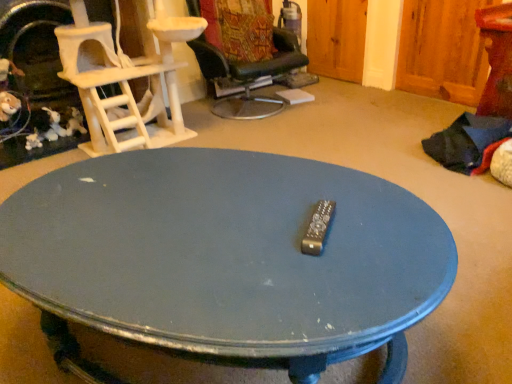
Question: From a real-world perspective, is black leather chair at upper center, acting as the 1th chair starting from the right, located higher than white textured cat tree at left, positioned as the first chair in left-to-right order?

Choices:
 (A) no
 (B) yes

Answer: (A)

Question: Is the surface of black leather chair at upper center, which ranks as the second chair in left-to-right order, in direct contact with white textured cat tree at left, positioned as the first chair in left-to-right order?

Choices:
 (A) no
 (B) yes

Answer: (A)

Question: Is black leather chair at upper center, which ranks as the second chair in left-to-right order, oriented away from white textured cat tree at left, positioned as the first chair in left-to-right order?

Choices:
 (A) yes
 (B) no

Answer: (B)

Question: Would you say black leather chair at upper center, which ranks as the second chair in left-to-right order, is a long distance from white textured cat tree at left, arranged as the second chair when viewed from the right?

Choices:
 (A) yes
 (B) no

Answer: (B)

Question: Is white textured cat tree at left, arranged as the second chair when viewed from the right, completely or partially inside black leather chair at upper center, acting as the 1th chair starting from the right?

Choices:
 (A) no
 (B) yes

Answer: (A)

Question: Is black leather chair at upper center, which ranks as the second chair in left-to-right order, further to camera compared to white textured cat tree at left, positioned as the first chair in left-to-right order?

Choices:
 (A) no
 (B) yes

Answer: (B)

Question: Is the depth of blue painted wood coffee table at center greater than that of white textured cat tree at left, positioned as the first chair in left-to-right order?

Choices:
 (A) no
 (B) yes

Answer: (A)

Question: Considering the relative sizes of blue painted wood coffee table at center and white textured cat tree at left, positioned as the first chair in left-to-right order, in the image provided, is blue painted wood coffee table at center shorter than white textured cat tree at left, positioned as the first chair in left-to-right order,?

Choices:
 (A) yes
 (B) no

Answer: (A)

Question: Is the position of blue painted wood coffee table at center less distant than that of white textured cat tree at left, positioned as the first chair in left-to-right order?

Choices:
 (A) yes
 (B) no

Answer: (A)

Question: From the image's perspective, is blue painted wood coffee table at center above white textured cat tree at left, positioned as the first chair in left-to-right order?

Choices:
 (A) no
 (B) yes

Answer: (A)

Question: Would you say blue painted wood coffee table at center is outside white textured cat tree at left, positioned as the first chair in left-to-right order?

Choices:
 (A) yes
 (B) no

Answer: (A)

Question: Is the surface of blue painted wood coffee table at center in direct contact with white textured cat tree at left, positioned as the first chair in left-to-right order?

Choices:
 (A) yes
 (B) no

Answer: (B)

Question: From the image's perspective, is white textured cat tree at left, arranged as the second chair when viewed from the right, under blue painted wood coffee table at center?

Choices:
 (A) no
 (B) yes

Answer: (A)